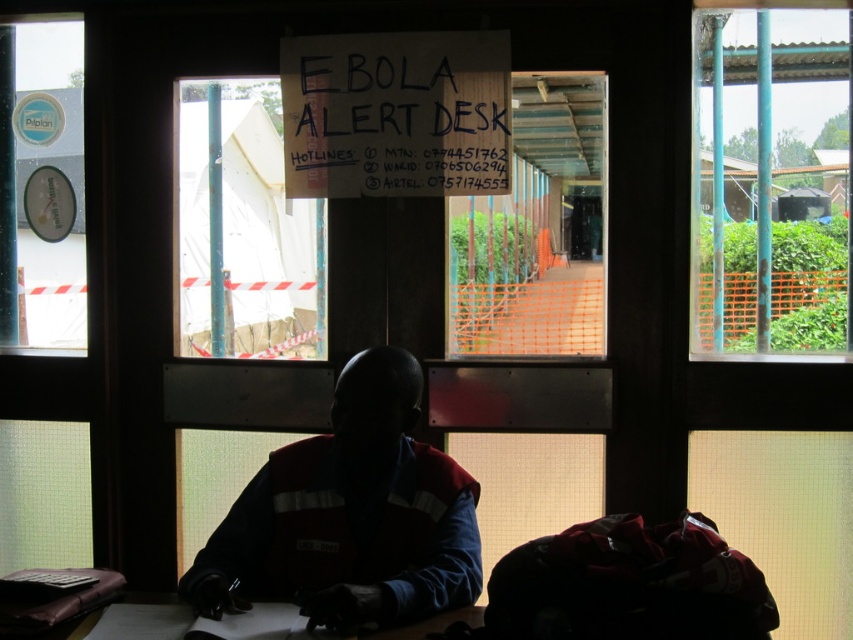
You are standing at the point labeled point (294, 120) and want to move to the point labeled point (373, 360). Based on the scene description, which direction should you move to reach your destination?

To move from point (294, 120) to point (373, 360), you should move forward because point (373, 360) is in front of point (294, 120) according to the spatial relationship provided.

Looking at this image, you are standing in the room and need to determine the position of the dark blue fabric uniform at center relative to the desk. Is it closer to the desk or farther away?

The dark blue fabric uniform at center is located at point (351, 515), which indicates its position relative to the desk. Since the coordinates are specific, it is positioned at the center of the desk, making it closer to the desk.

You are organizing items on the desk and need to place the red fabric bag at lower right and the wooden desk at lower center. Since the desk is smaller, where should you place the larger item to ensure it doesn

The red fabric bag at lower right is bigger than the wooden desk at lower center. Therefore, you should place the red fabric bag at lower right on the floor or another surface since it cannot fit on the smaller wooden desk at lower center.